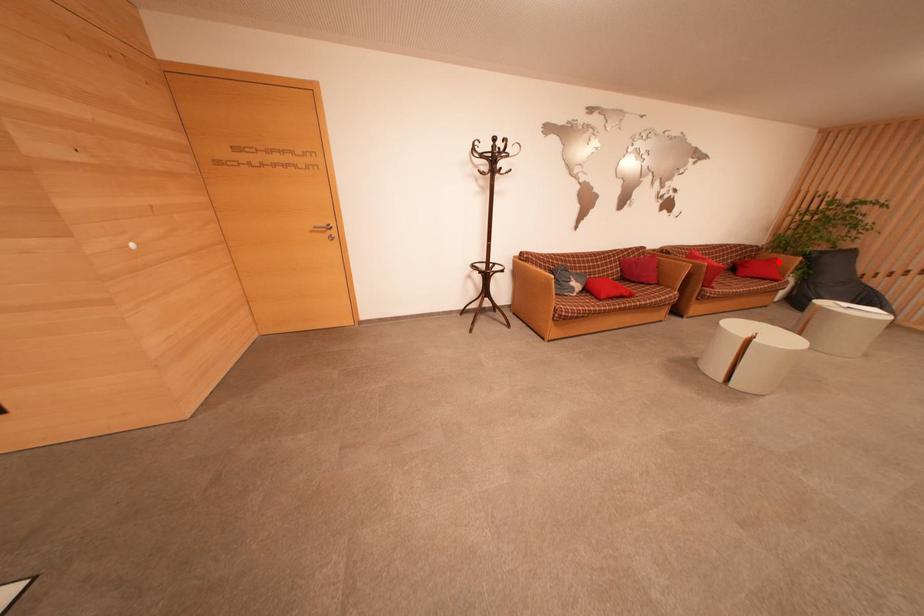
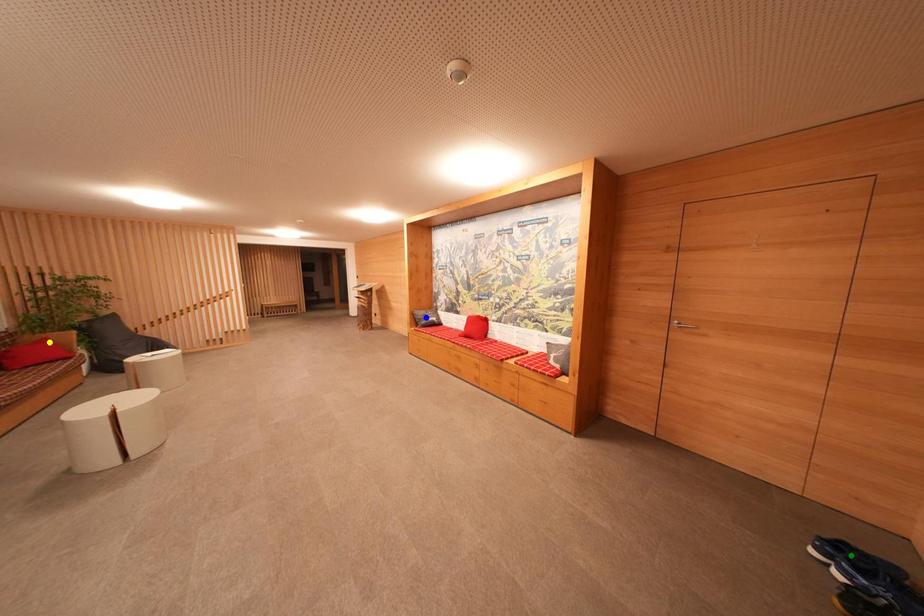
Question: I am providing you with two images of the same scene from different viewpoints. A red point is marked on the first image. You are given multiple points on the second image. Which point in image 2 represents the same 3d spot as the red point in image 1?

Choices:
 (A) yellow point
 (B) blue point
 (C) green point

Answer: (A)